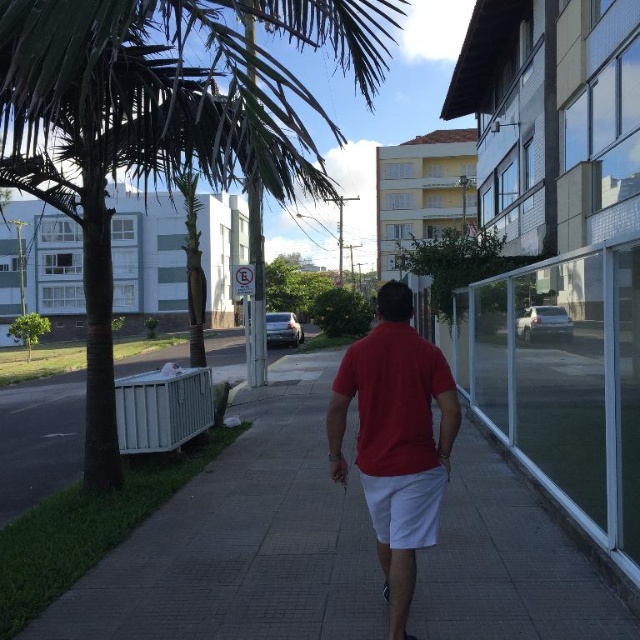
You are a delivery robot with a 24 feet wide package. You need to move from the gray concrete pavement at center to the white concrete pavement at lower left. Can you fit through the space between them?

The gray concrete pavement at center and white concrete pavement at lower left are 24.02 feet apart, so the 24 feet wide package can fit through the space between them since the distance is slightly larger than the package width.

You are standing at the point marked by the coordinates point (163,122). Which direction should you walk to reach the man in the red polo shirt and white shorts who is walking away from you?

The green leafy palm tree at left is represented by point (163,122). The man is walking away from the camera, so if you are at the palm tree point, you should walk towards the right direction to reach him as he moves away from the camera.

You are a delivery person who needs to place a package on the gray concrete pavement at center and the white concrete pavement at lower left. Which area has enough space to place the package without overlapping the other?

The white concrete pavement at lower left has a larger size compared to the gray concrete pavement at center, so placing the package there would provide more space without overlapping.